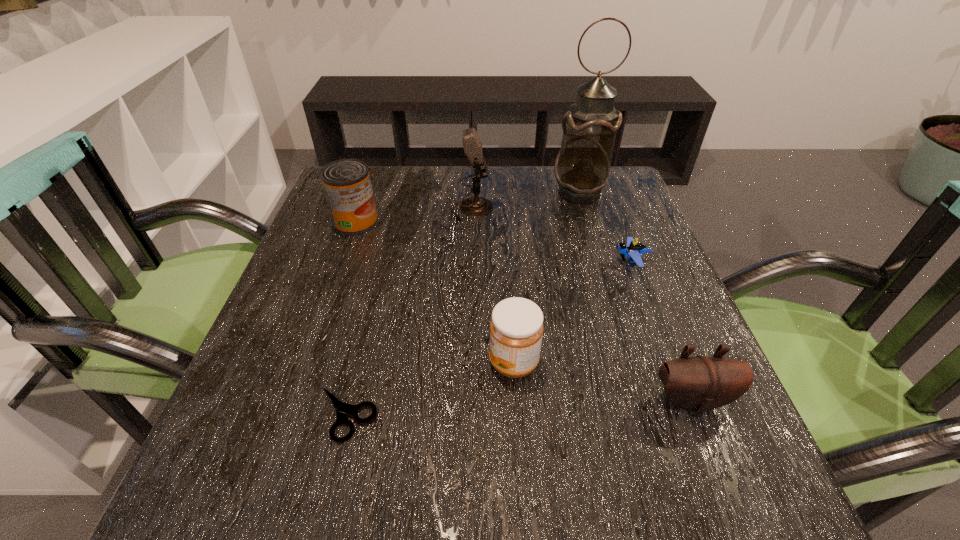
Locate an element on the screen. The width and height of the screenshot is (960, 540). blank area located 0.220m on the right of the can is located at coordinates (470, 222).

The height and width of the screenshot is (540, 960). Identify the location of blank space located on the front label of the jam. (271, 362).

Locate an element on the screen. vacant region located on the front label of the jam is located at coordinates (318, 362).

Locate an element on the screen. The width and height of the screenshot is (960, 540). vacant space located on the front label of the jam is located at coordinates (276, 362).

Find the location of `vacant space located 0.130m with the flap open on the pouch`. vacant space located 0.130m with the flap open on the pouch is located at coordinates (734, 510).

Find the location of a particular element. The image size is (960, 540). vacant space located on the front-facing side of the Lego is located at coordinates (539, 261).

You are a GUI agent. You are given a task and a screenshot of the screen. Output one action in this format:
    pyautogui.click(x=<x>, y=<y>)
    Task: Click on the vacant space situated on the front-facing side of the Lego
    The image size is (960, 540).
    Given the screenshot: What is the action you would take?
    pyautogui.click(x=510, y=261)

You are a GUI agent. You are given a task and a screenshot of the screen. Output one action in this format:
    pyautogui.click(x=<x>, y=<y>)
    Task: Click on the vacant region located 0.210m on the front-facing side of the Lego
    This screenshot has height=540, width=960.
    Given the screenshot: What is the action you would take?
    pyautogui.click(x=515, y=261)

You are a GUI agent. You are given a task and a screenshot of the screen. Output one action in this format:
    pyautogui.click(x=<x>, y=<y>)
    Task: Click on the vacant area situated 0.250m on the right of the shears
    
    Given the screenshot: What is the action you would take?
    [540, 414]

Image resolution: width=960 pixels, height=540 pixels. Find the location of `oil lamp that is positioned at the far edge`. oil lamp that is positioned at the far edge is located at coordinates (582, 168).